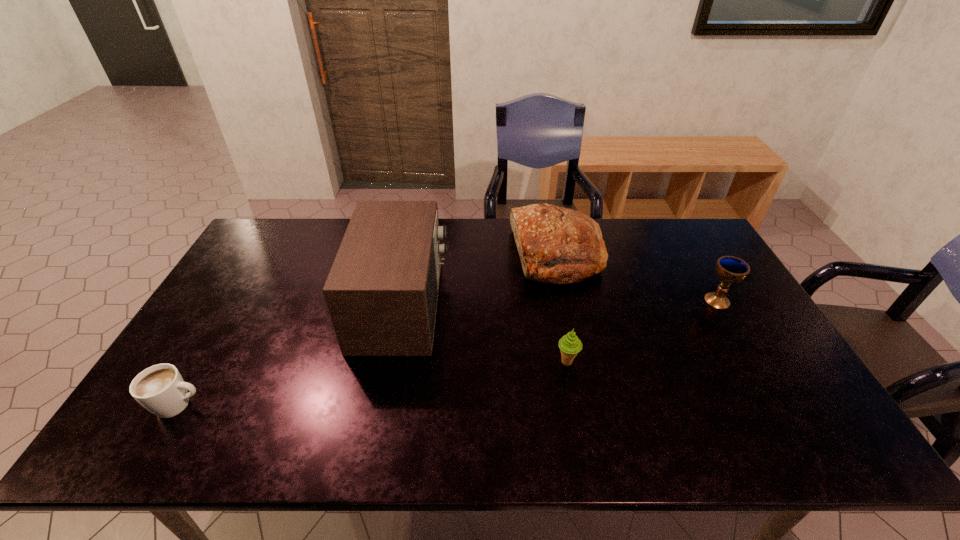
The image size is (960, 540). I want to click on the tallest object, so click(x=382, y=290).

The width and height of the screenshot is (960, 540). Identify the location of the fourth object from right to left. (382, 290).

Locate an element on the screen. The height and width of the screenshot is (540, 960). the second tallest object is located at coordinates (558, 245).

At what (x,y) coordinates should I click in order to perform the action: click on the rightmost object. Please return your answer as a coordinate pair (x, y). The image size is (960, 540). Looking at the image, I should click on (729, 269).

At what (x,y) coordinates should I click in order to perform the action: click on icecream. Please return your answer as a coordinate pair (x, y). The width and height of the screenshot is (960, 540). Looking at the image, I should click on (569, 344).

I want to click on the shortest object, so click(x=160, y=389).

Locate an element on the screen. cappuccino is located at coordinates (160, 389).

Where is `vacant space situated on the front-facing side of the radio receiver`? Image resolution: width=960 pixels, height=540 pixels. vacant space situated on the front-facing side of the radio receiver is located at coordinates pos(549,304).

The image size is (960, 540). Find the location of `free space located at the sliced front of the fourth shortest object`. free space located at the sliced front of the fourth shortest object is located at coordinates (446, 256).

Where is `free space located at the sliced front of the fourth shortest object`? The width and height of the screenshot is (960, 540). free space located at the sliced front of the fourth shortest object is located at coordinates click(x=475, y=256).